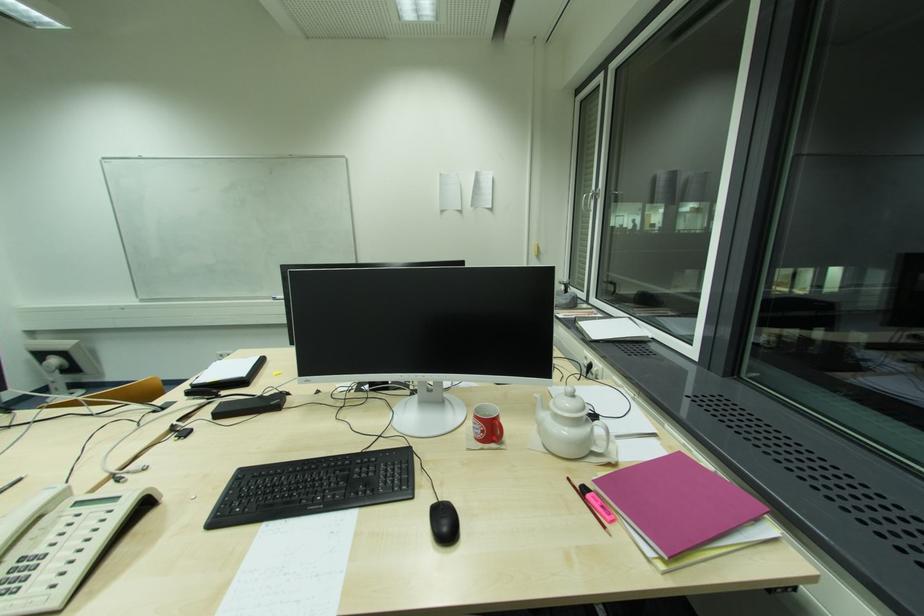
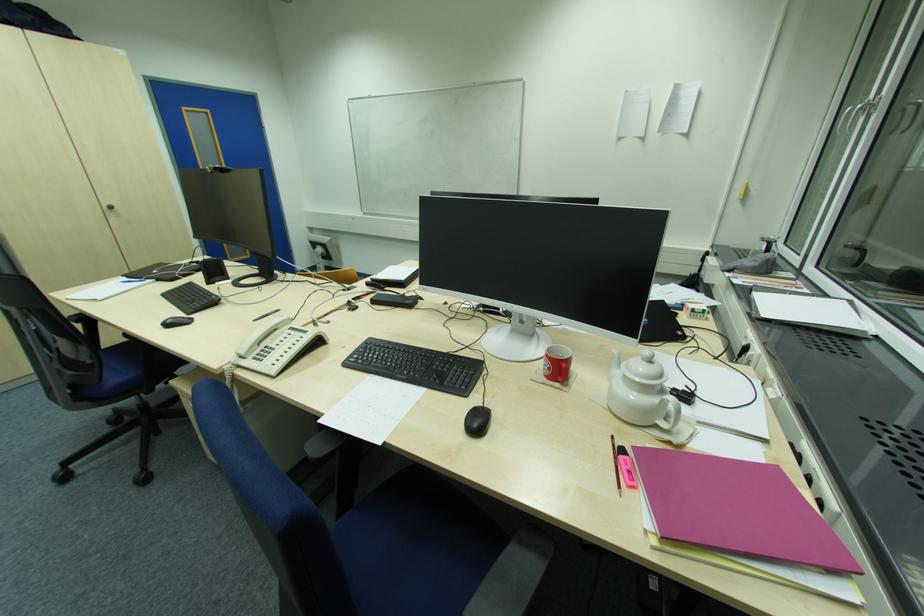
Locate, in the second image, the point that corresponds to (669,559) in the first image.

(662, 537)